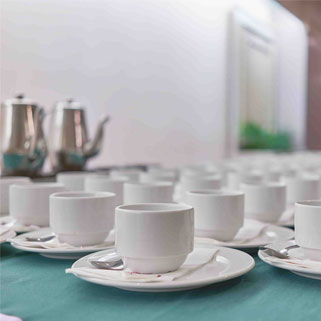
You are a GUI agent. You are given a task and a screenshot of the screen. Output one action in this format:
    pyautogui.click(x=<x>, y=<y>)
    Task: Click on the saucer
    The image size is (321, 321).
    Given the screenshot: What is the action you would take?
    pyautogui.click(x=2, y=230), pyautogui.click(x=57, y=248), pyautogui.click(x=226, y=265), pyautogui.click(x=284, y=245), pyautogui.click(x=269, y=230), pyautogui.click(x=284, y=215)